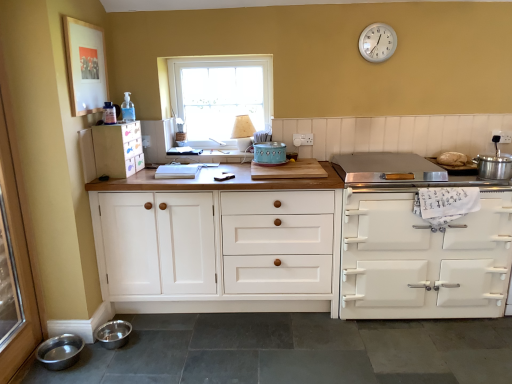
Where is `empty space that is ontop of white painted wood cabinet at left, the first cabinetry when ordered from left to right`? empty space that is ontop of white painted wood cabinet at left, the first cabinetry when ordered from left to right is located at coordinates (117, 116).